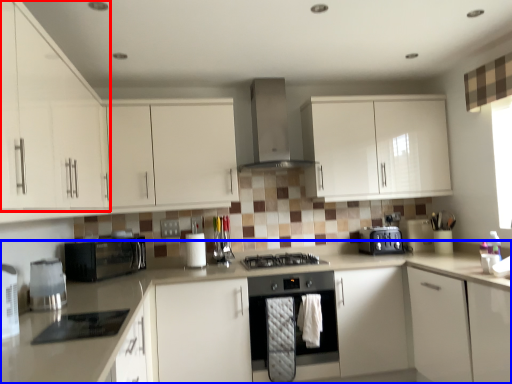
Question: Which of the following is the farthest to the observer, cabinetry (highlighted by a red box) or countertop (highlighted by a blue box)?

Choices:
 (A) cabinetry
 (B) countertop

Answer: (A)